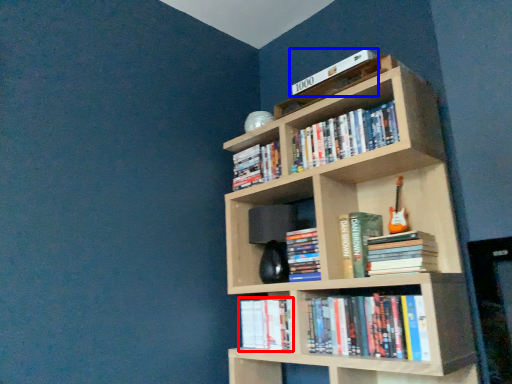
Question: Which object appears farthest to the camera in this image, book (highlighted by a red box) or book (highlighted by a blue box)?

Choices:
 (A) book
 (B) book

Answer: (A)